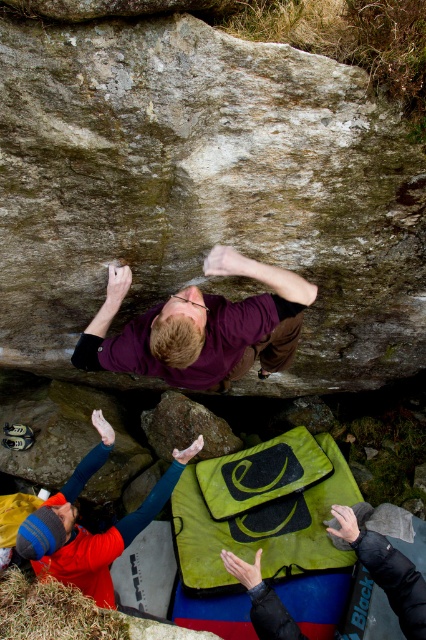
Question: Can you confirm if purple matte shirt at upper center is positioned to the left of yellow fleece jacket at lower left?

Choices:
 (A) yes
 (B) no

Answer: (B)

Question: Can you confirm if purple matte shirt at upper center is positioned above yellow fleece jacket at lower left?

Choices:
 (A) yes
 (B) no

Answer: (A)

Question: Does purple matte shirt at upper center come behind yellow fleece jacket at lower left?

Choices:
 (A) no
 (B) yes

Answer: (A)

Question: Among these points, which one is nearest to the camera?

Choices:
 (A) (149, 356)
 (B) (97, 468)

Answer: (A)

Question: Among these objects, which one is farthest from the camera?

Choices:
 (A) yellow fleece jacket at lower left
 (B) purple matte shirt at upper center

Answer: (A)